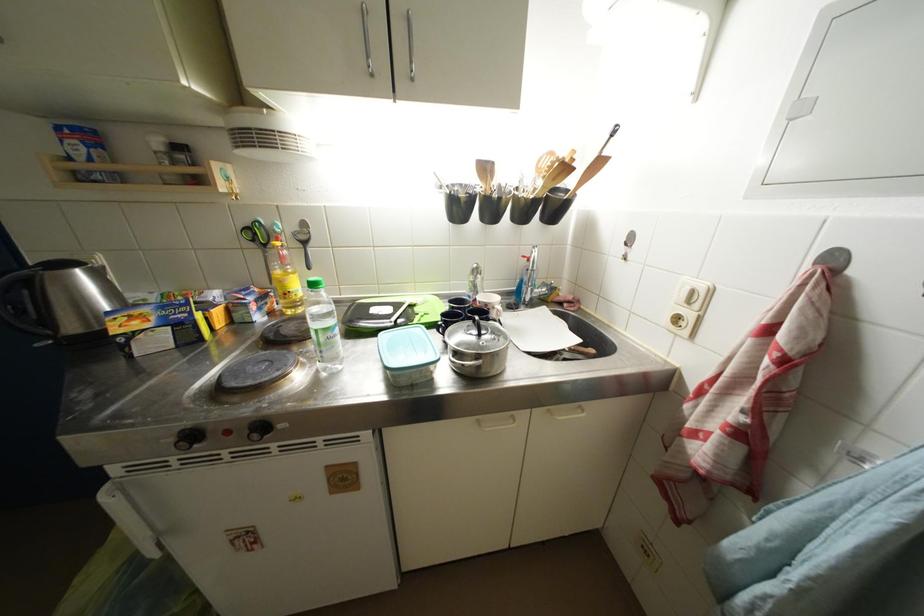
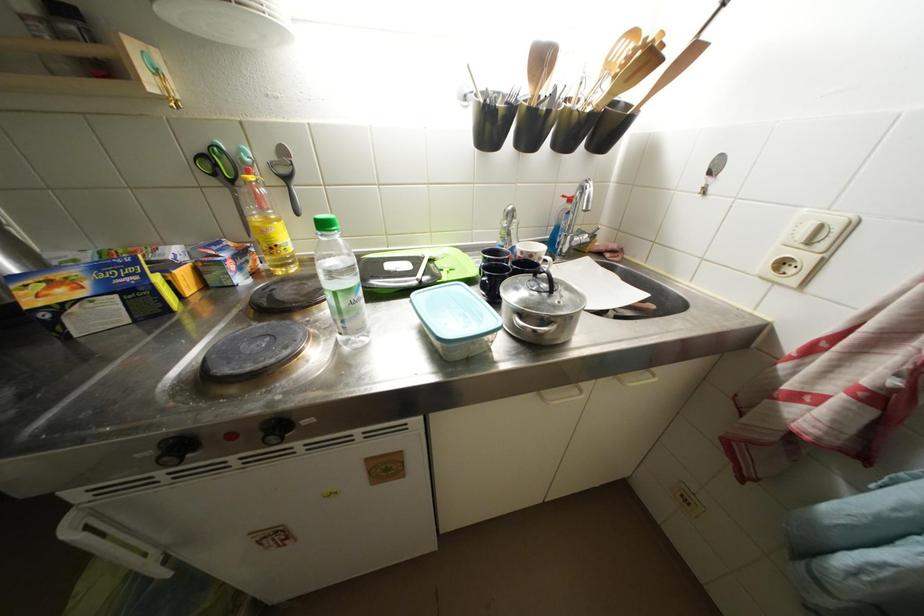
Looking at this image, the images are taken continuously from a first-person perspective. In which direction are you moving?

The movement direction of the cameraman is left, forward.